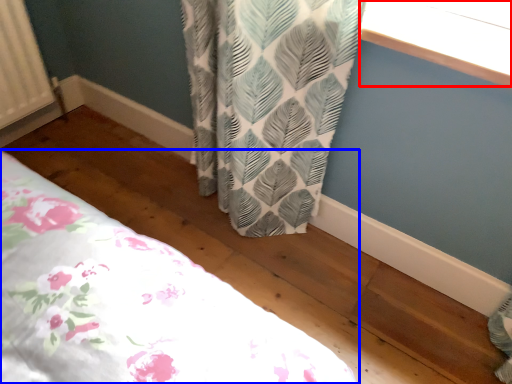
Question: Among these objects, which one is farthest to the camera, window screen (highlighted by a red box) or bed (highlighted by a blue box)?

Choices:
 (A) window screen
 (B) bed

Answer: (B)